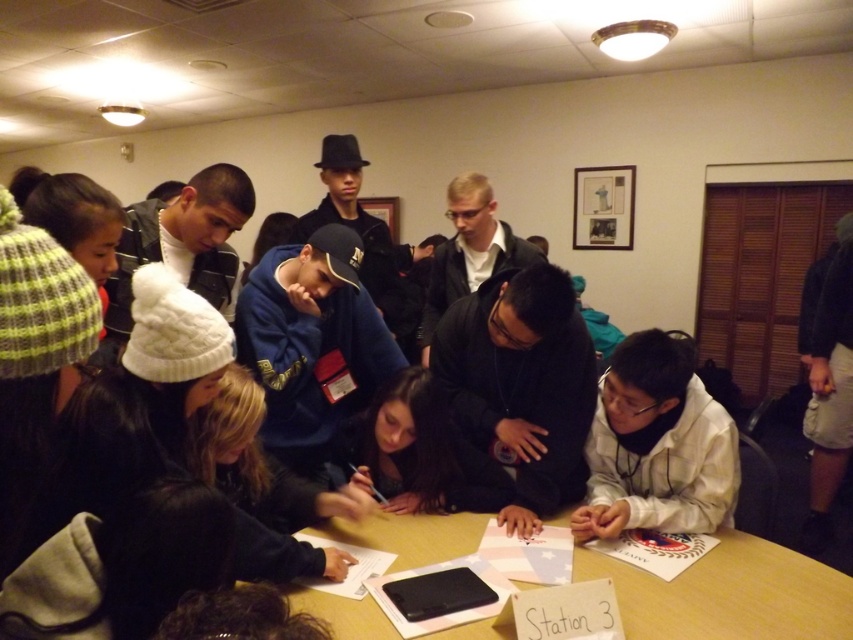
You are standing in the room and want to reach the wooden table at center from the white matte shirt at lower right. Which direction should you move?

You should move to the left to reach the wooden table at center from the white matte shirt at lower right since the wooden table at center is to the left of the white matte shirt at lower right.

You are standing in the room and want to place a 4.5 feet long object on the wooden table at center. Can you fit it on the table without moving any items?

The distance between you and the wooden table at center is 4.43 feet, but this measurement refers to the distance from the viewer to the table, not the table length. The table length is unknown, so it is impossible to determine if the 4.5 feet long object will fit without additional information about the table dimensions.

You are standing at point A at the bottom of the image. You want to walk to point B at the top of the image. There is a person at point C located at point (427,637). What is the shortest path you can take to avoid walking too close to the person at point C?

The shortest path would be to walk around the person at point C by moving either to the left or right of them, maintaining a distance of at least 4.48 feet to ensure you don not get too close.